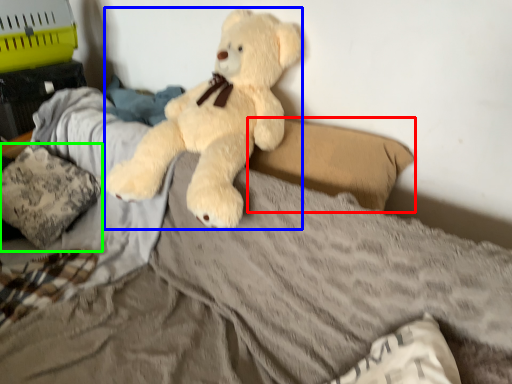
Question: Which object is positioned closest to pillow (highlighted by a red box)? Select from teddy bear (highlighted by a blue box) and pillow (highlighted by a green box).

Choices:
 (A) teddy bear
 (B) pillow

Answer: (A)